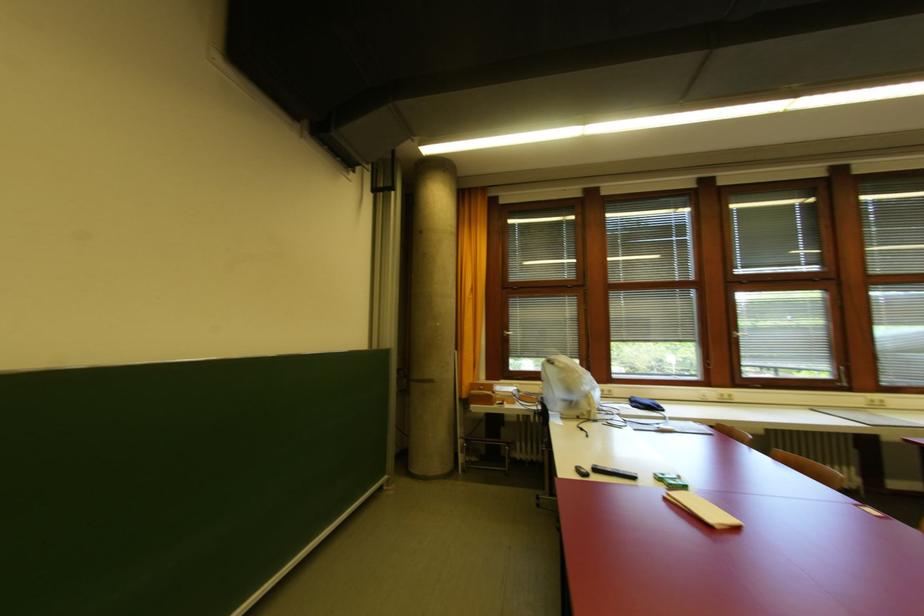
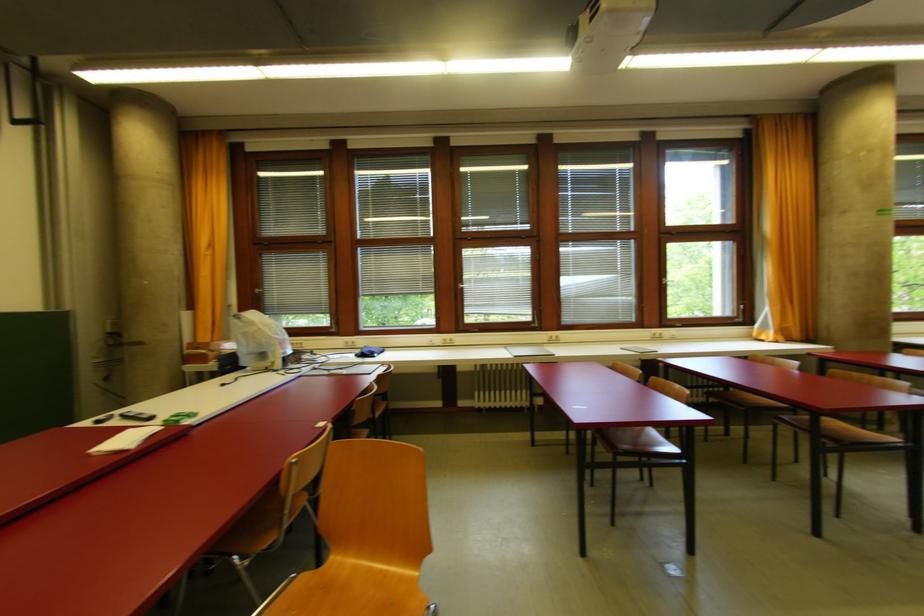
Where in the second image is the point corresponding to [880,405] from the first image?

(556, 339)